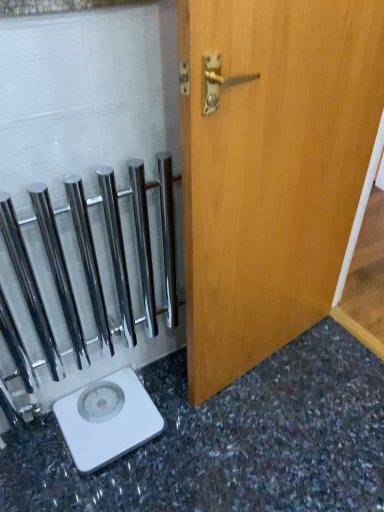
Question: Does polished chrome towel bars at left come behind light brown wood door at center?

Choices:
 (A) no
 (B) yes

Answer: (B)

Question: Is polished chrome towel bars at left positioned before light brown wood door at center?

Choices:
 (A) yes
 (B) no

Answer: (B)

Question: Can you confirm if polished chrome towel bars at left is positioned to the right of light brown wood door at center?

Choices:
 (A) no
 (B) yes

Answer: (A)

Question: Does polished chrome towel bars at left appear on the left side of light brown wood door at center?

Choices:
 (A) no
 (B) yes

Answer: (B)

Question: Is light brown wood door at center at the back of polished chrome towel bars at left?

Choices:
 (A) yes
 (B) no

Answer: (B)

Question: In the image, is granite gray surface at lower left on the left side or the right side of polished chrome towel bars at left?

Choices:
 (A) left
 (B) right

Answer: (B)

Question: From the image's perspective, is granite gray surface at lower left positioned above or below polished chrome towel bars at left?

Choices:
 (A) below
 (B) above

Answer: (A)

Question: Is point (59, 487) positioned closer to the camera than point (69, 93)?

Choices:
 (A) closer
 (B) farther

Answer: (B)

Question: Considering their positions, is granite gray surface at lower left located in front of or behind polished chrome towel bars at left?

Choices:
 (A) front
 (B) behind

Answer: (A)

Question: Considering the positions of light brown wood door at center and granite gray surface at lower left in the image, is light brown wood door at center taller or shorter than granite gray surface at lower left?

Choices:
 (A) short
 (B) tall

Answer: (B)

Question: Do you think light brown wood door at center is within granite gray surface at lower left, or outside of it?

Choices:
 (A) inside
 (B) outside

Answer: (B)

Question: Is light brown wood door at center to the left or to the right of granite gray surface at lower left in the image?

Choices:
 (A) left
 (B) right

Answer: (B)

Question: Considering their positions, is light brown wood door at center located in front of or behind granite gray surface at lower left?

Choices:
 (A) behind
 (B) front

Answer: (B)

Question: Relative to light brown wood door at center, is white plastic scale at lower left in front or behind?

Choices:
 (A) front
 (B) behind

Answer: (B)

Question: Choose the correct answer: Is white plastic scale at lower left inside light brown wood door at center or outside it?

Choices:
 (A) outside
 (B) inside

Answer: (A)